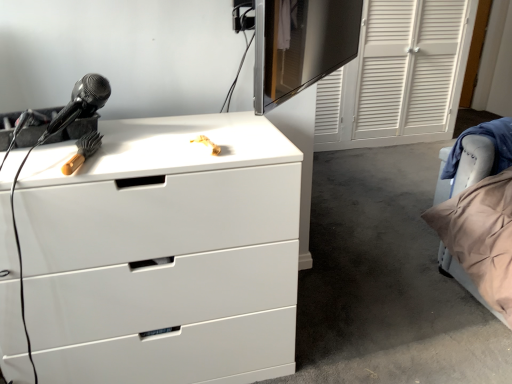
Identify the location of white glossy chest of drawers at upper left. (163, 253).

From the image's perspective, is white glossy chest of drawers at upper left under velvet beige pillow at right?

Yes, from the image's perspective, white glossy chest of drawers at upper left is beneath velvet beige pillow at right.

Can you confirm if white glossy chest of drawers at upper left is taller than velvet beige pillow at right?

Yes, white glossy chest of drawers at upper left is taller than velvet beige pillow at right.

Is white glossy chest of drawers at upper left further to the viewer compared to velvet beige pillow at right?

No, the depth of white glossy chest of drawers at upper left is less than that of velvet beige pillow at right.

Is white glossy chest of drawers at upper left located outside black glossy monitor at upper center?

Indeed, white glossy chest of drawers at upper left is completely outside black glossy monitor at upper center.

Is white glossy chest of drawers at upper left facing away from black glossy monitor at upper center?

No.

Consider the image. From the image's perspective, which is below, white glossy chest of drawers at upper left or black glossy monitor at upper center?

From the image's view, white glossy chest of drawers at upper left is below.

Is point (360, 17) positioned after point (478, 161)?

Yes, point (360, 17) is behind point (478, 161).

Consider the image. From the image's perspective, is black glossy monitor at upper center on top of velvet beige pillow at right?

Correct, black glossy monitor at upper center appears higher than velvet beige pillow at right in the image.

What's the angular difference between black glossy monitor at upper center and velvet beige pillow at right's facing directions?

They differ by 130 degrees in their facing directions.

Is there a large distance between black glossy monitor at upper center and velvet beige pillow at right?

Absolutely, black glossy monitor at upper center is distant from velvet beige pillow at right.

Looking at this image, is velvet beige pillow at right wider than white glossy chest of drawers at upper left?

No, velvet beige pillow at right is not wider than white glossy chest of drawers at upper left.

Is velvet beige pillow at right touching white glossy chest of drawers at upper left?

No, velvet beige pillow at right is not next to white glossy chest of drawers at upper left.

Does velvet beige pillow at right have a greater height compared to white glossy chest of drawers at upper left?

No.

Can you confirm if black glossy monitor at upper center is smaller than white glossy chest of drawers at upper left?

Correct, black glossy monitor at upper center occupies less space than white glossy chest of drawers at upper left.

Measure the distance between black glossy monitor at upper center and white glossy chest of drawers at upper left.

black glossy monitor at upper center is 11.66 feet from white glossy chest of drawers at upper left.

Is white glossy chest of drawers at upper left at the back of black glossy monitor at upper center?

No.

From a real-world perspective, which is physically above, black glossy monitor at upper center or white glossy chest of drawers at upper left?

black glossy monitor at upper center is physically above.

Can you confirm if velvet beige pillow at right is positioned to the right of black glossy monitor at upper center?

Yes, velvet beige pillow at right is to the right of black glossy monitor at upper center.

How far apart are velvet beige pillow at right and black glossy monitor at upper center?

velvet beige pillow at right is 3.07 meters away from black glossy monitor at upper center.

Identify the location of computer monitor in front of the velvet beige pillow at right. The width and height of the screenshot is (512, 384). (301, 45).

This screenshot has width=512, height=384. Find the location of `bed located underneath the white glossy chest of drawers at upper left (from a real-world perspective)`. bed located underneath the white glossy chest of drawers at upper left (from a real-world perspective) is located at coordinates (481, 236).

Identify the location of the chest of drawers behind the black glossy monitor at upper center. The height and width of the screenshot is (384, 512). (163, 253).

From the image, which object appears to be nearer to white glossy chest of drawers at upper left, velvet beige pillow at right or black glossy monitor at upper center?

velvet beige pillow at right.

Based on their spatial positions, is black glossy monitor at upper center or white glossy chest of drawers at upper left further from velvet beige pillow at right?

Among the two, black glossy monitor at upper center is located further to velvet beige pillow at right.

When comparing their distances from black glossy monitor at upper center, does white glossy chest of drawers at upper left or velvet beige pillow at right seem further?

Among the two, white glossy chest of drawers at upper left is located further to black glossy monitor at upper center.

Considering their positions, is white glossy chest of drawers at upper left positioned closer to velvet beige pillow at right than black glossy monitor at upper center?

Among the two, white glossy chest of drawers at upper left is located nearer to velvet beige pillow at right.

Based on their spatial positions, is velvet beige pillow at right or white glossy chest of drawers at upper left closer to black glossy monitor at upper center?

velvet beige pillow at right lies closer to black glossy monitor at upper center than the other object.

From the image, which object appears to be farther from white glossy chest of drawers at upper left, black glossy monitor at upper center or velvet beige pillow at right?

black glossy monitor at upper center.

At what (x,y) coordinates should I click in order to perform the action: click on computer monitor situated between white glossy chest of drawers at upper left and velvet beige pillow at right from left to right. Please return your answer as a coordinate pair (x, y). Looking at the image, I should click on click(301, 45).